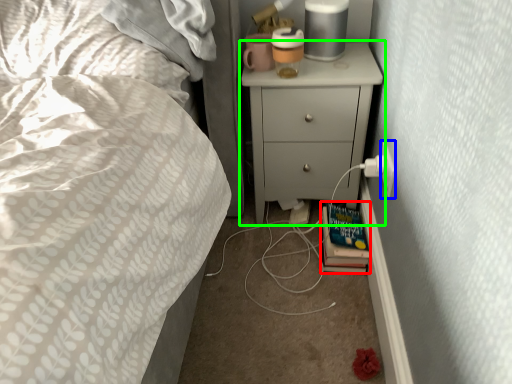
Question: Which object is the closest to the book (highlighted by a red box)? Choose among these: electric outlet (highlighted by a blue box) or chest of drawers (highlighted by a green box).

Choices:
 (A) electric outlet
 (B) chest of drawers

Answer: (A)